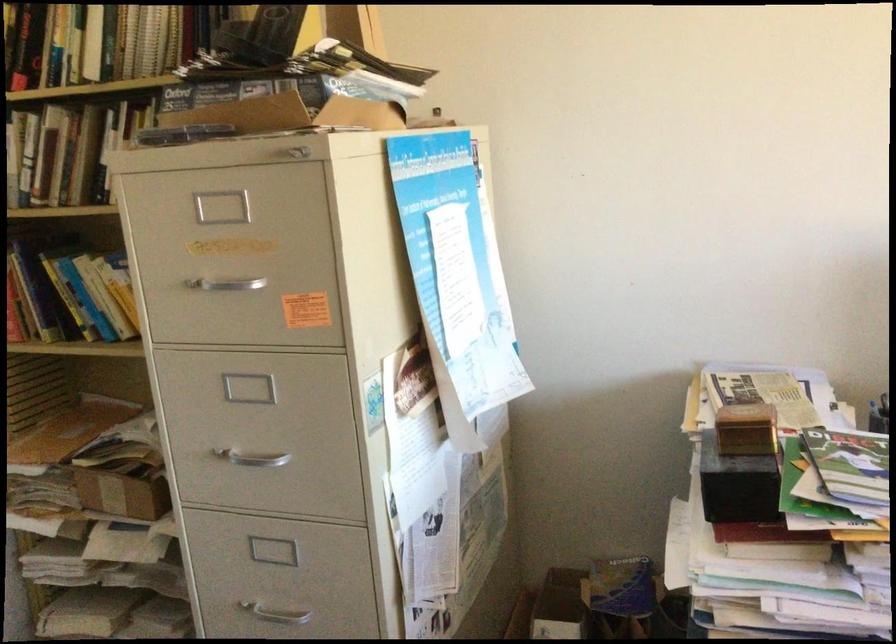
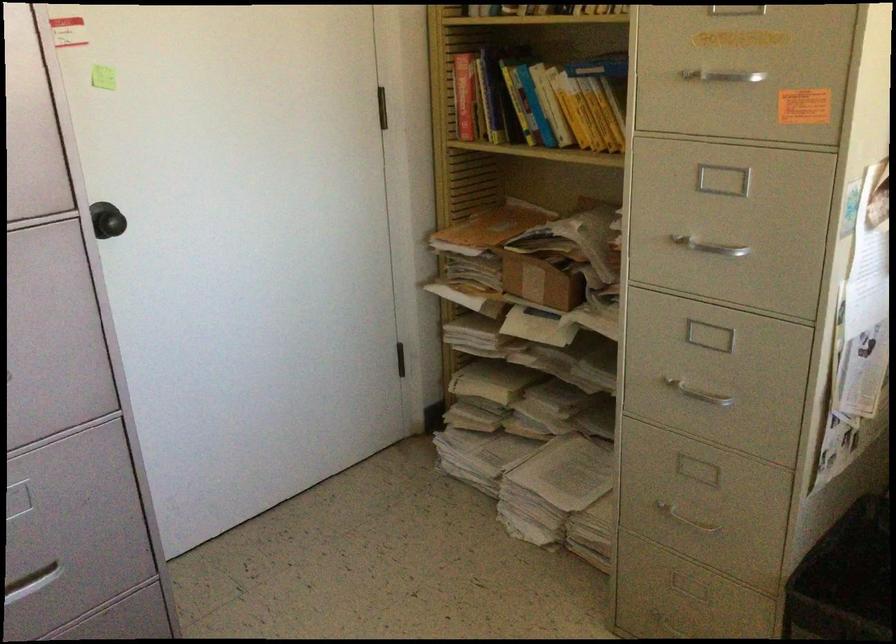
The point at (257, 458) is marked in the first image. Where is the corresponding point in the second image?

(710, 248)